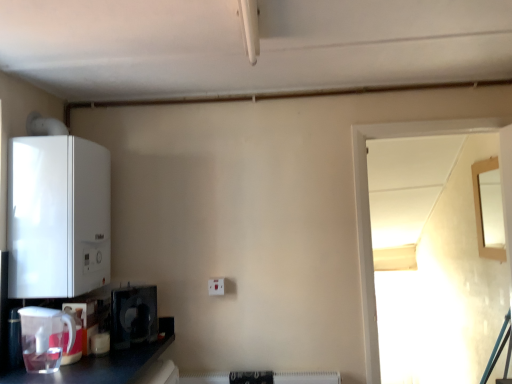
Question: From a real-world perspective, is black plastic microwave at lower left, the second appliance in the bottom-to-top sequence, above or below wooden framed mirror at upper right, the 1th window when ordered from right to left?

Choices:
 (A) above
 (B) below

Answer: (B)

Question: Does point (139, 319) appear closer or farther from the camera than point (501, 248)?

Choices:
 (A) farther
 (B) closer

Answer: (B)

Question: Which object is the farthest from the transparent glass door at right, acting as the second window starting from the right?

Choices:
 (A) white glossy boiler at left, the 1th appliance from the top
 (B) white plastic electric outlet at center
 (C) wooden framed mirror at upper right, which appears as the 1th window when viewed from the back
 (D) white plastic jug at lower left, which ranks as the 2th appliance in top-to-bottom order
 (E) matte white kettle at lower left, which is the first appliance from bottom to top

Answer: (D)

Question: Based on their relative distances, which object is nearer to the white plastic electric outlet at center?

Choices:
 (A) wooden framed mirror at upper right, the 2th window from the left
 (B) transparent glass door at right, acting as the second window starting from the right
 (C) matte white kettle at lower left, the fourth appliance from the top
 (D) black plastic microwave at lower left, the second appliance in the bottom-to-top sequence
 (E) white plastic jug at lower left, which ranks as the 2th appliance in top-to-bottom order

Answer: (D)